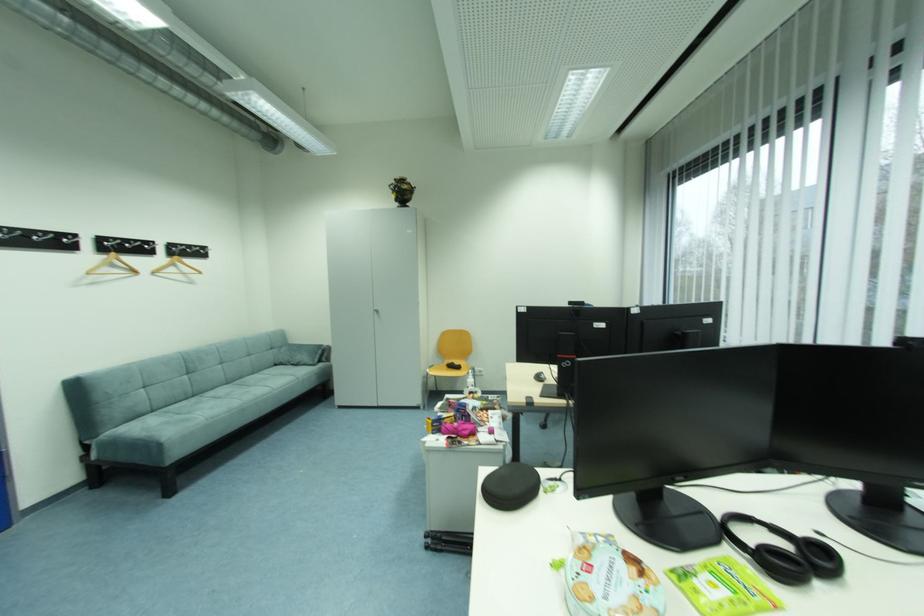
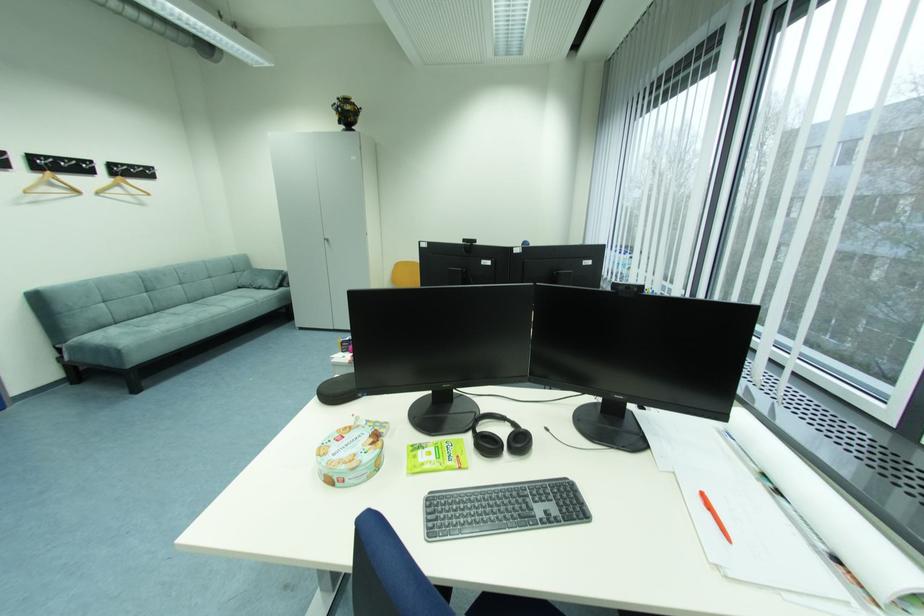
The point at [306,363] is marked in the first image. Where is the corresponding point in the second image?

(266, 286)